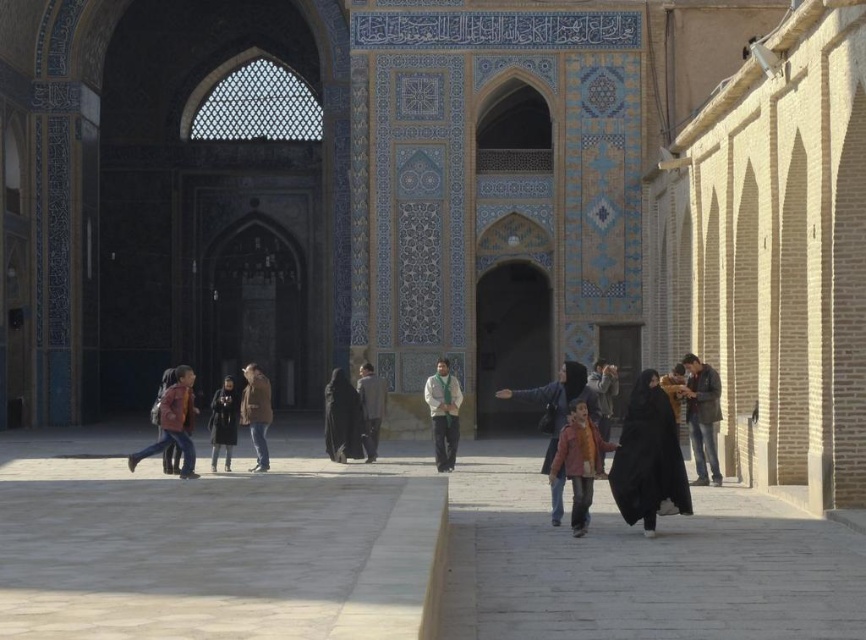
Question: Estimate the real-world distances between objects in this image. Which object is farther from the dark gray fabric jacket at center?

Choices:
 (A) light beige sweater at center
 (B) matte pink jacket at center

Answer: (B)

Question: Is orange fleece jacket at center to the left of dark matte black dress at center from the viewer's perspective?

Choices:
 (A) yes
 (B) no

Answer: (B)

Question: Can you confirm if orange fleece jacket at center is positioned to the right of dark gray fabric jacket at center?

Choices:
 (A) yes
 (B) no

Answer: (A)

Question: Based on their relative distances, which object is nearer to the dark gray fabric at center?

Choices:
 (A) dark matte black dress at center
 (B) matte brown backpack at center

Answer: (A)

Question: Does dark gray fabric jacket at center have a larger size compared to dark gray fabric at center?

Choices:
 (A) yes
 (B) no

Answer: (A)

Question: Which point is closer to the camera taking this photo?

Choices:
 (A) (380, 410)
 (B) (572, 385)

Answer: (B)